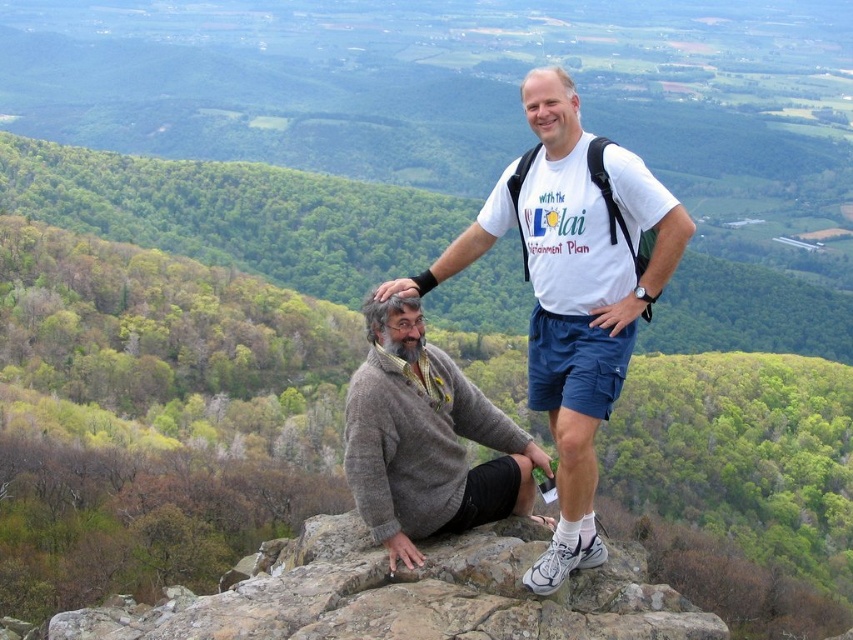
You are standing at the point with coordinates point (521, 618) and want to walk towards the point with coordinates point (491, 243). Which direction should you move relative to the other point?

You should move towards the point (491, 243), which is behind point (521, 618). Since point (491, 243) is behind point (521, 618), you should move in the direction away from the other point.

You are a photographer planning to take a picture of the scene. The camera is positioned at a certain distance from the point marked as point [248,586]. If the camera has a focal length of 50mm and the sensor size is 24mm x 36mm, what is the approximate distance in meters between the camera and the point?

The distance of point [248,586] from the camera is 32.37 meters, so the camera is approximately 32.37 meters away from the point.